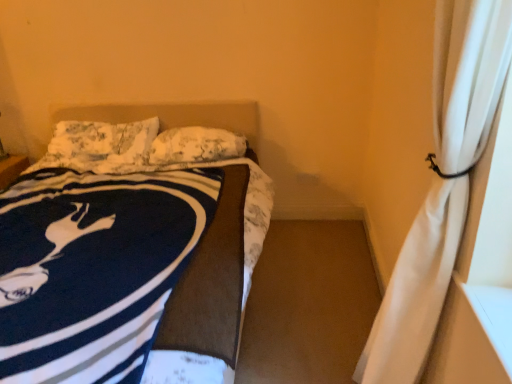
Question: Looking at their shapes, would you say navy blue fleece blanket at left is wider or thinner than white sheer curtain at right?

Choices:
 (A) thin
 (B) wide

Answer: (B)

Question: In the image, is navy blue fleece blanket at left positioned in front of or behind white sheer curtain at right?

Choices:
 (A) front
 (B) behind

Answer: (B)

Question: Which object is positioned farthest from the white textured pillow at center, which appears as the 2th pillow when viewed from the left?

Choices:
 (A) navy blue fleece blanket at left
 (B) fluffy white pillow at upper left, which is the 1th pillow in left-to-right order
 (C) white sheer curtain at right

Answer: (C)

Question: Estimate the real-world distances between objects in this image. Which object is farther from the white sheer curtain at right?

Choices:
 (A) fluffy white pillow at upper left, which is the 1th pillow in left-to-right order
 (B) navy blue fleece blanket at left
 (C) white textured pillow at center, placed as the 1th pillow when sorted from right to left

Answer: (A)